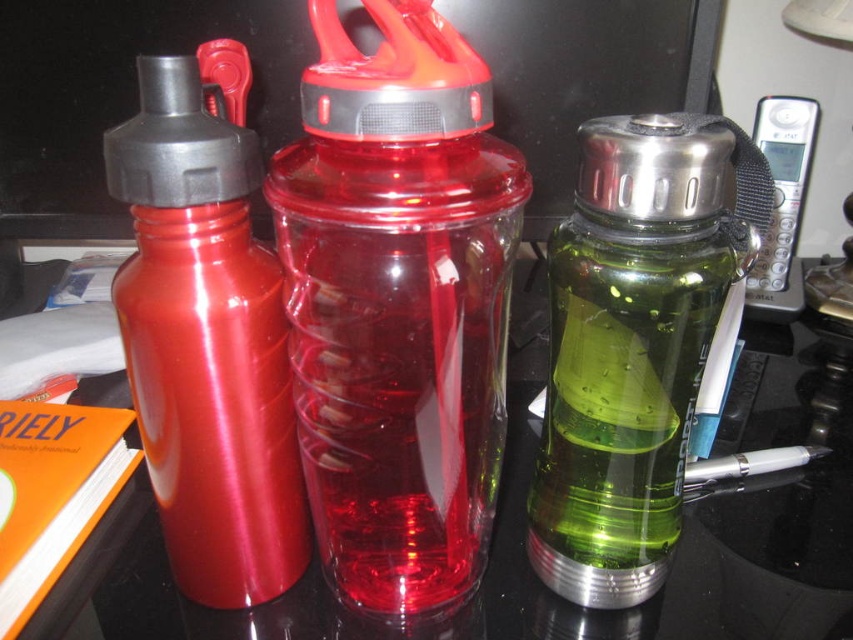
Question: Considering the real-world distances, which object is farthest from the green translucent water bottle at center?

Choices:
 (A) transparent plastic bottle at center
 (B) metallic red water bottle at left

Answer: (B)

Question: Can you confirm if green translucent water bottle at center is smaller than metallic red water bottle at left?

Choices:
 (A) yes
 (B) no

Answer: (B)

Question: Which of the following is the closest to the observer?

Choices:
 (A) (154, 355)
 (B) (496, 464)

Answer: (A)

Question: Is transparent plastic bottle at center below metallic red water bottle at left?

Choices:
 (A) no
 (B) yes

Answer: (B)

Question: Among these points, which one is farthest from the camera?

Choices:
 (A) (381, 170)
 (B) (160, 140)

Answer: (B)

Question: Is green translucent water bottle at center thinner than metallic red water bottle at left?

Choices:
 (A) no
 (B) yes

Answer: (A)